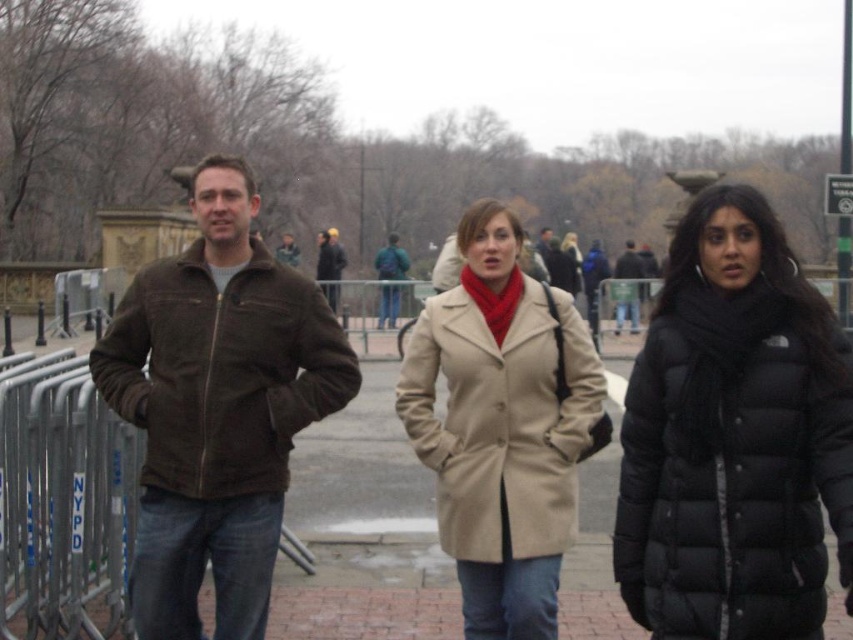
You are a photographer taking a picture of the woman in the beige coat with a red scarf. You notice the green fabric backpack at center and the brown suede jacket at center. Which object is positioned higher in the image?

The green fabric backpack at center is positioned higher in the image than the brown suede jacket at center.

You are a photographer standing at the camera position. You want to take a photo of the woman in the beige coat with a red scarf and ensure that the green fabric backpack at center is visible in the frame. Based on the coordinates provided, is the backpack positioned in a way that it will be in the same frame as the woman?

The green fabric backpack at center is located at coordinates (392, 260), which places it centrally in the frame. Since the woman is also at the center, the backpack will be visible in the same frame as her.